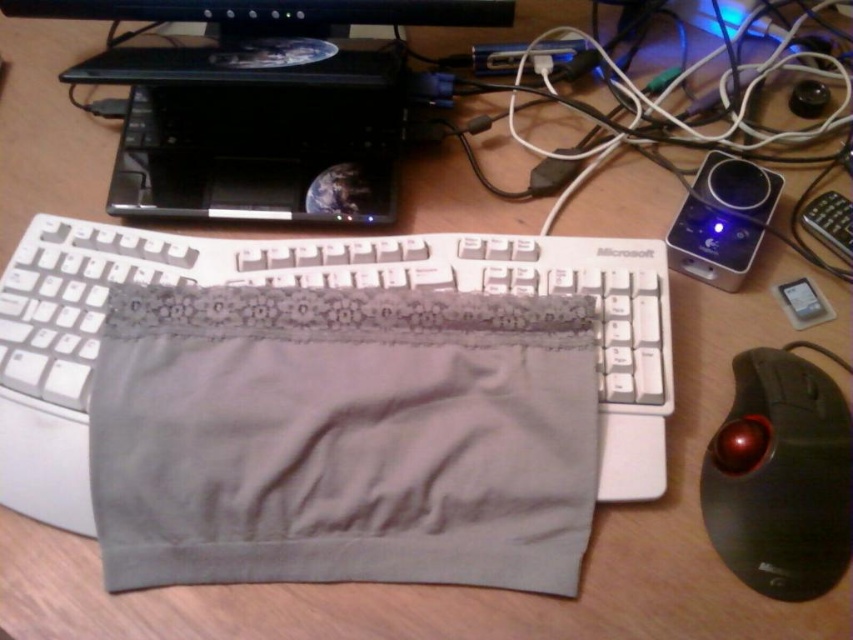
You are organizing your desk and need to place a new item between the satin black laptop at upper center and the black rubberized trackball at lower right. Considering their sizes, which object should you place closer to the edge of the desk to save space?

The black rubberized trackball at lower right is smaller in size than the satin black laptop at upper center. To save space, place the smaller black rubberized trackball at lower right closer to the edge of the desk.

You are setting up a new monitor and want to place it next to the existing black plastic monitor at upper center. However, there is limited space on the desk. Given the size of the satin black laptop at upper center, can the new monitor fit next to the existing one without overlapping?

The satin black laptop at upper center has a lesser width compared to the black plastic monitor at upper center. This means there might be enough space to place the new monitor next to the existing black plastic monitor at upper center without overlapping, as the laptop itself is narrower and may not obstruct the space required for the new monitor.